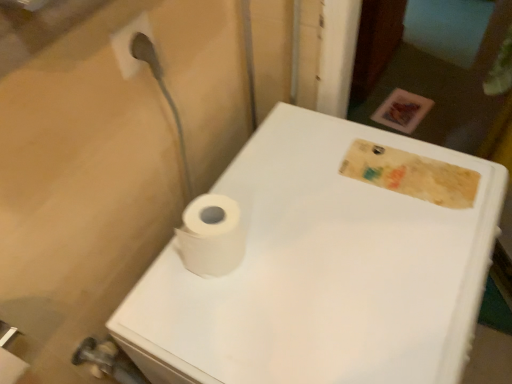
Find the location of `unoccupied area behind white matte toilet paper at center`. unoccupied area behind white matte toilet paper at center is located at coordinates (261, 175).